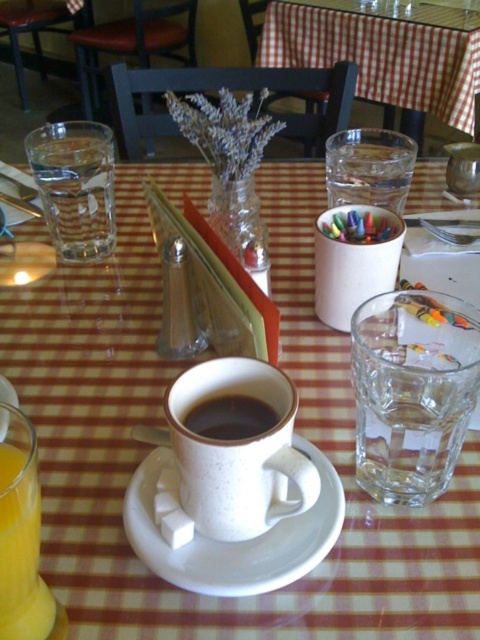
You are a barista carrying a tray of drinks and need to place a new glass of water on the table. The table has limited space. The existing clear glass water at right is 13.51 inches away from you. Can you estimate if placing another glass of water next to it would exceed the table edge?

The clear glass water at right is 13.51 inches away from the viewer. Since the table edge distance isn not provided, it is impossible to determine if placing another glass would exceed it. More information is needed about the table dimensions or the space available between the existing glass and the edge.

You are a customer sitting at the table in the image. You want to grab the speckled ceramic mug at center without moving the checkered fabric tablecloth at center. Is this possible?

The speckled ceramic mug at center is below the checkered fabric tablecloth at center, so you can grab the speckled ceramic mug at center without moving the checkered fabric tablecloth at center.

You are a barista holding a tray and standing 10 inches away from the table. You need to place a new coffee cup exactly where the speckled ceramic mug at center is currently located. Can you reach that spot without moving closer to the table?

The speckled ceramic mug at center is 12.44 inches away from the viewer. Since you are currently 10 inches away, you are closer than the required distance. Therefore, you need to move back to position the new coffee cup at the exact location of the speckled ceramic mug at center.